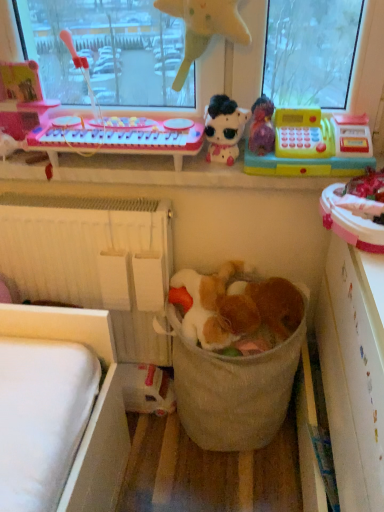
Question: From the image's perspective, is shiny plastic toy piano at upper left, which is the 1th toy in left-to-right order, under white textured radiator at lower left?

Choices:
 (A) yes
 (B) no

Answer: (B)

Question: Does shiny plastic toy piano at upper left, which is the 5th toy in right-to-left order, have a smaller size compared to white textured radiator at lower left?

Choices:
 (A) yes
 (B) no

Answer: (A)

Question: Is shiny plastic toy piano at upper left, which is the 5th toy in right-to-left order, bigger than white textured radiator at lower left?

Choices:
 (A) yes
 (B) no

Answer: (B)

Question: Would you say shiny plastic toy piano at upper left, the 4th toy positioned from the bottom, is outside white textured radiator at lower left?

Choices:
 (A) yes
 (B) no

Answer: (A)

Question: Is shiny plastic toy piano at upper left, which is counted as the 2th toy, starting from the top, far away from white textured radiator at lower left?

Choices:
 (A) no
 (B) yes

Answer: (A)

Question: In the image, is shiny plastic toy piano at upper left, which is counted as the 2th toy, starting from the top, positioned in front of or behind pink plastic keyboard at upper left?

Choices:
 (A) behind
 (B) front

Answer: (A)

Question: Considering the positions of shiny plastic toy piano at upper left, the 4th toy positioned from the bottom, and pink plastic keyboard at upper left in the image, is shiny plastic toy piano at upper left, the 4th toy positioned from the bottom, taller or shorter than pink plastic keyboard at upper left?

Choices:
 (A) short
 (B) tall

Answer: (B)

Question: In terms of size, does shiny plastic toy piano at upper left, which is the 1th toy in left-to-right order, appear bigger or smaller than pink plastic keyboard at upper left?

Choices:
 (A) small
 (B) big

Answer: (A)

Question: Is shiny plastic toy piano at upper left, which is counted as the 2th toy, starting from the top, to the left or to the right of pink plastic keyboard at upper left in the image?

Choices:
 (A) right
 (B) left

Answer: (B)

Question: Would you say white plastic shelf at right is to the left or to the right of white matte plush toy at upper center, which is the 3th toy from left to right, in the picture?

Choices:
 (A) left
 (B) right

Answer: (B)

Question: In terms of height, does white plastic shelf at right look taller or shorter compared to white matte plush toy at upper center, the third toy ordered from the bottom?

Choices:
 (A) tall
 (B) short

Answer: (A)

Question: Considering their positions, is white plastic shelf at right located in front of or behind white matte plush toy at upper center, the third toy ordered from the bottom?

Choices:
 (A) behind
 (B) front

Answer: (B)

Question: From a real-world perspective, is white plastic shelf at right positioned above or below white matte plush toy at upper center, which is the 3th toy from left to right?

Choices:
 (A) above
 (B) below

Answer: (B)

Question: Considering the positions of white plastic shelf at right and beige fabric laundry basket at center in the image, is white plastic shelf at right taller or shorter than beige fabric laundry basket at center?

Choices:
 (A) short
 (B) tall

Answer: (B)

Question: From a real-world perspective, relative to beige fabric laundry basket at center, is white plastic shelf at right vertically above or below?

Choices:
 (A) below
 (B) above

Answer: (B)